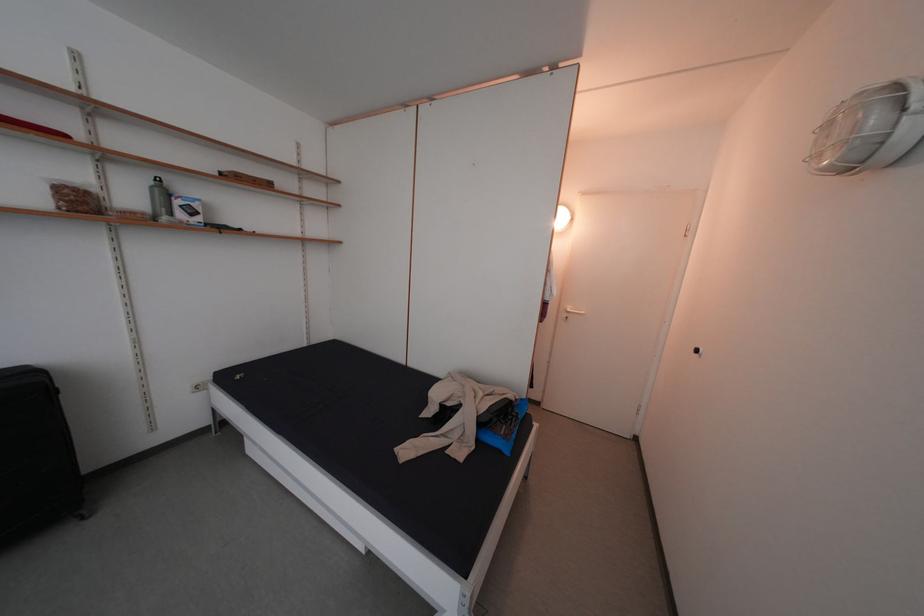
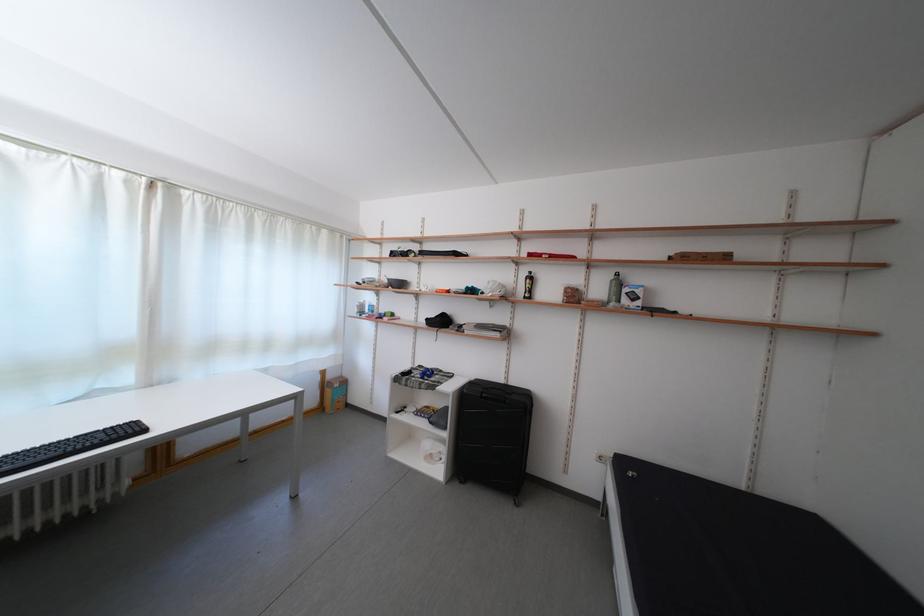
Question: How did the camera likely rotate?

Choices:
 (A) Left
 (B) Right
 (C) Up
 (D) Down

Answer: (A)